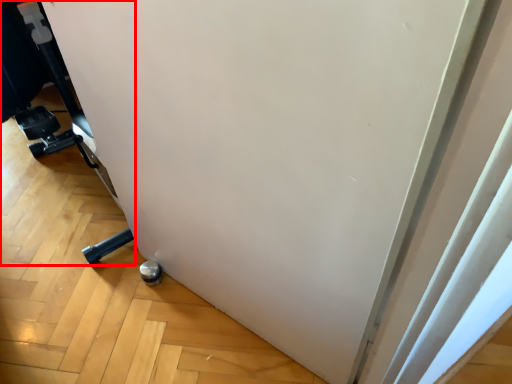
Question: In this image, where is furniture (annotated by the red box) located relative to wheel?

Choices:
 (A) right
 (B) left

Answer: (B)